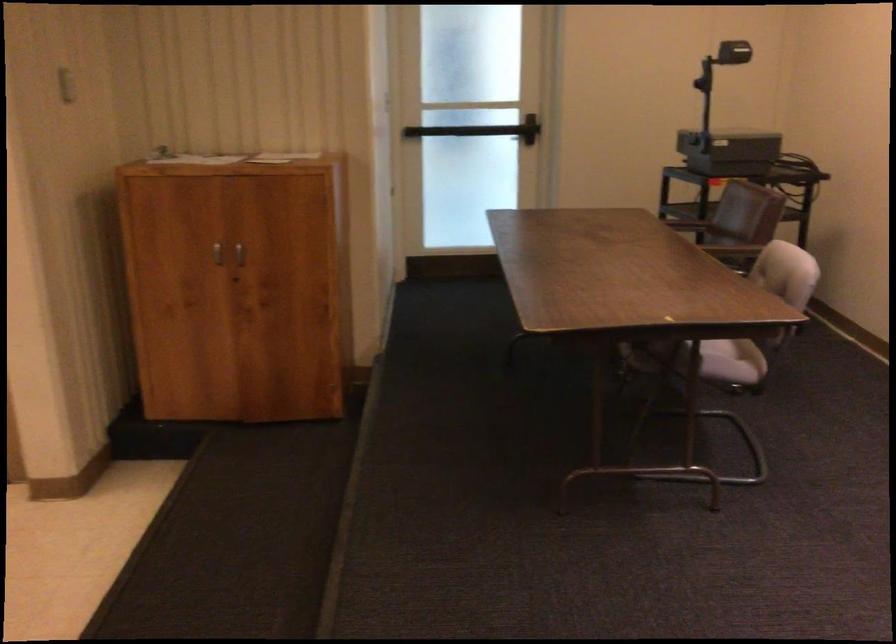
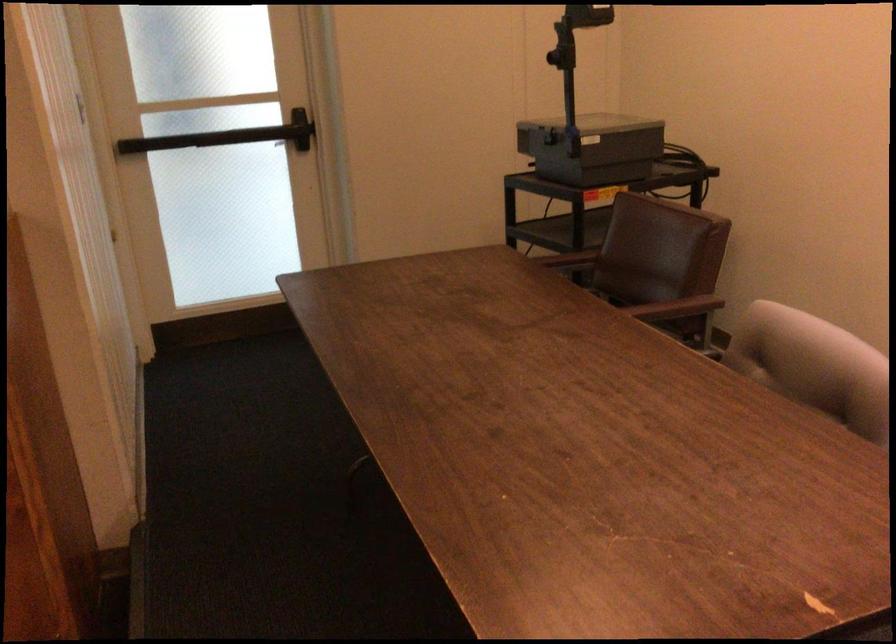
Question: I am providing you with two images of the same scene from different viewpoints. After the viewpoint changes to image2, which objects are now occluded?

Choices:
 (A) curtain edge
 (B) brown chair armrest
 (C) gray chair sitting surface
 (D) overhead projector

Answer: (C)